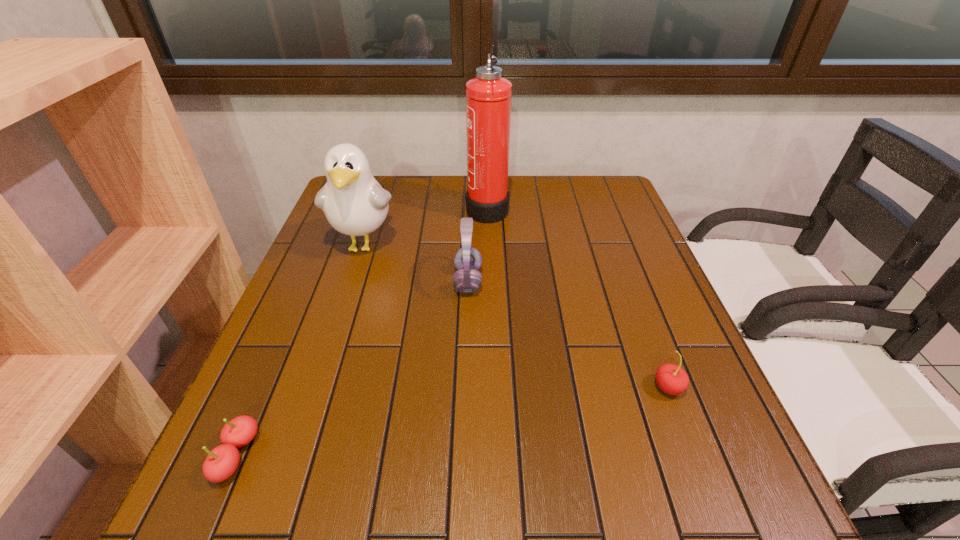
Image resolution: width=960 pixels, height=540 pixels. I want to click on free spot between the fourth tallest object and the left cherry, so click(x=453, y=422).

You are a GUI agent. You are given a task and a screenshot of the screen. Output one action in this format:
    pyautogui.click(x=<x>, y=<y>)
    Task: Click on the free point between the shorter cherry and the headset
    This screenshot has height=540, width=960.
    Given the screenshot: What is the action you would take?
    tap(352, 368)

This screenshot has height=540, width=960. What are the coordinates of `free space that is in between the tallest object and the gull` in the screenshot? It's located at (425, 226).

The image size is (960, 540). I want to click on vacant area that lies between the fourth shortest object and the second nearest object, so click(x=516, y=316).

You are a GUI agent. You are given a task and a screenshot of the screen. Output one action in this format:
    pyautogui.click(x=<x>, y=<y>)
    Task: Click on the vacant region between the third tallest object and the gull
    The width and height of the screenshot is (960, 540).
    Given the screenshot: What is the action you would take?
    pyautogui.click(x=416, y=263)

Locate an element on the screen. This screenshot has height=540, width=960. vacant space in between the third shortest object and the tallest object is located at coordinates (478, 244).

Locate which object is the closest to the fire extinguisher. Please provide its 2D coordinates. Your answer should be formatted as a tuple, i.e. [(x, y)], where the tuple contains the x and y coordinates of a point satisfying the conditions above.

[(467, 260)]

Identify which object is the third closest to the third tallest object. Please provide its 2D coordinates. Your answer should be formatted as a tuple, i.e. [(x, y)], where the tuple contains the x and y coordinates of a point satisfying the conditions above.

[(672, 379)]

Find the location of a particular element. free region that satisfies the following two spatial constraints: 1. on the headband and ear cups of the headset; 2. on the front side of the left cherry is located at coordinates (463, 456).

The height and width of the screenshot is (540, 960). Identify the location of free space that satisfies the following two spatial constraints: 1. on the headband and ear cups of the third shortest object; 2. on the right side of the fourth farthest object. (465, 387).